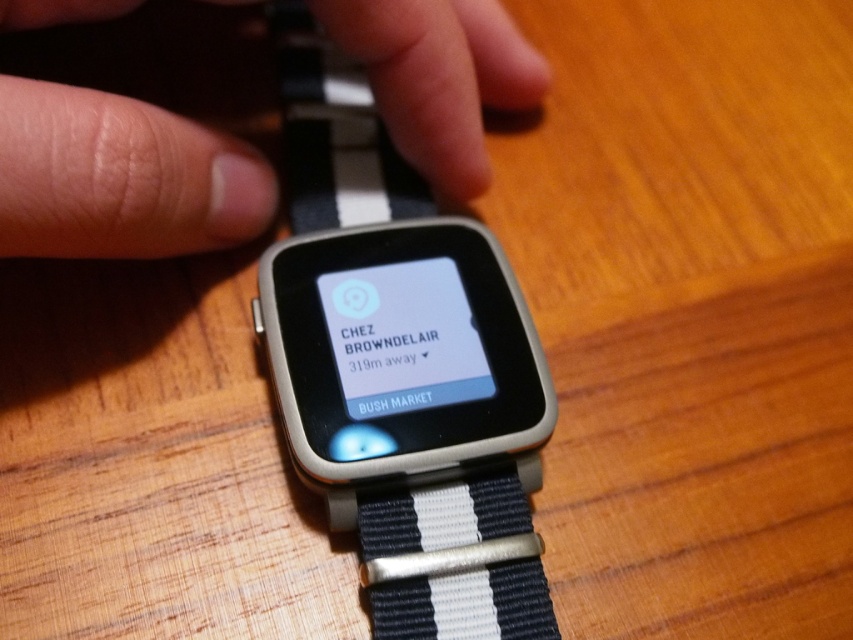
Does black woven band at center appear on the right side of white matte watch band at center?

Yes, black woven band at center is to the right of white matte watch band at center.

Which of these two, black woven band at center or white matte watch band at center, stands shorter?

white matte watch band at center is shorter.

Find the location of a particular element. The image size is (853, 640). black woven band at center is located at coordinates (397, 381).

Where is `black woven band at center`? black woven band at center is located at coordinates (397, 381).

Who is positioned more to the left, black woven band at center or black matte text at center?

From the viewer's perspective, black woven band at center appears more on the left side.

Can you confirm if black woven band at center is positioned above black matte text at center?

Indeed, black woven band at center is positioned over black matte text at center.

Who is more forward, (543, 637) or (366, 365)?

Point (543, 637) is in front.

At what (x,y) coordinates should I click in order to perform the action: click on black woven band at center. Please return your answer as a coordinate pair (x, y). Looking at the image, I should click on pos(397,381).

Is white matte watch band at center positioned in front of black matte text at center?

Yes, it is.

Which is behind, point (190, 161) or point (428, 380)?

Positioned behind is point (428, 380).

The width and height of the screenshot is (853, 640). In order to click on white matte watch band at center in this screenshot , I will do `click(126, 131)`.

Locate an element on the screen. The image size is (853, 640). white matte watch band at center is located at coordinates (126, 131).